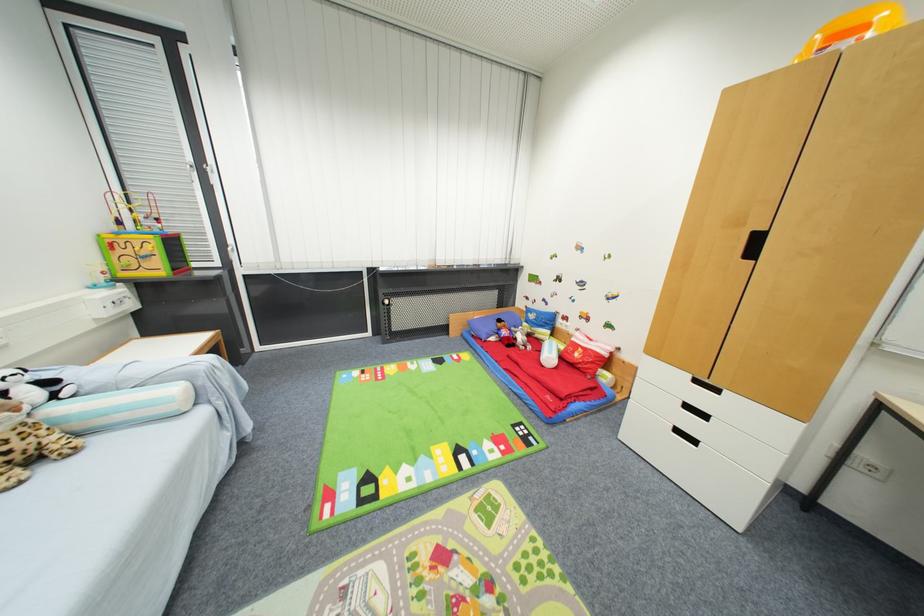
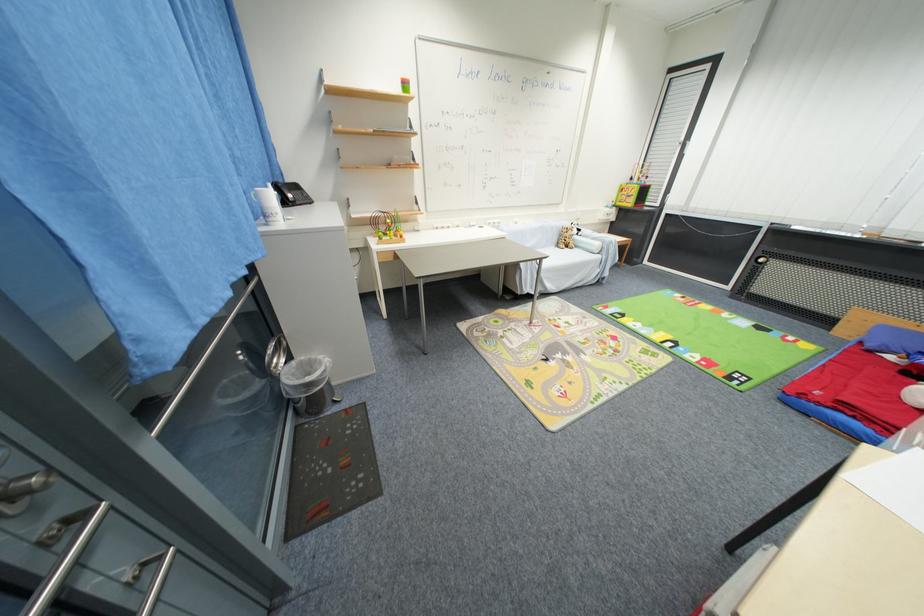
Where in the second image is the point corresponding to pixel 163 272 from the first image?

(635, 206)